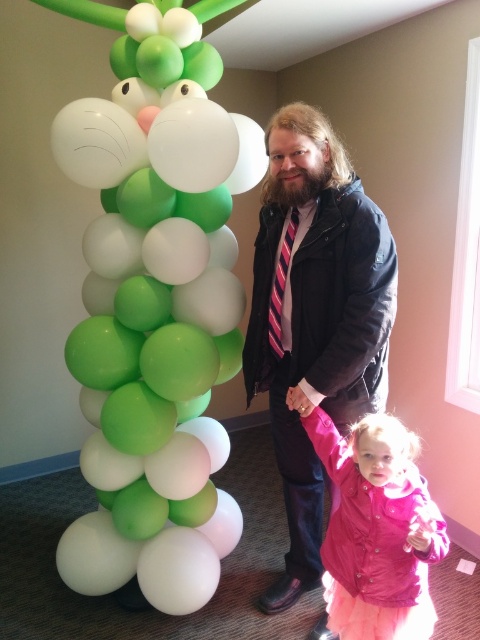
Question: Estimate the real-world distances between objects in this image. Which object is closer to the green matte balloon column at left?

Choices:
 (A) dark blue jacket at center
 (B) pink matte jacket at lower right

Answer: (A)

Question: Is pink matte jacket at lower right to the left of striped fabric tie at center from the viewer's perspective?

Choices:
 (A) yes
 (B) no

Answer: (B)

Question: Considering the relative positions of green matte balloon column at left and dark blue jacket at center in the image provided, where is green matte balloon column at left located with respect to dark blue jacket at center?

Choices:
 (A) left
 (B) right

Answer: (A)

Question: Which point appears closest to the camera in this image?

Choices:
 (A) (412, 605)
 (B) (384, 328)

Answer: (A)

Question: Does pink matte jacket at lower right have a lesser width compared to striped fabric tie at center?

Choices:
 (A) no
 (B) yes

Answer: (A)

Question: Estimate the real-world distances between objects in this image. Which object is closer to the dark blue jacket at center?

Choices:
 (A) striped fabric tie at center
 (B) pink matte jacket at lower right

Answer: (A)